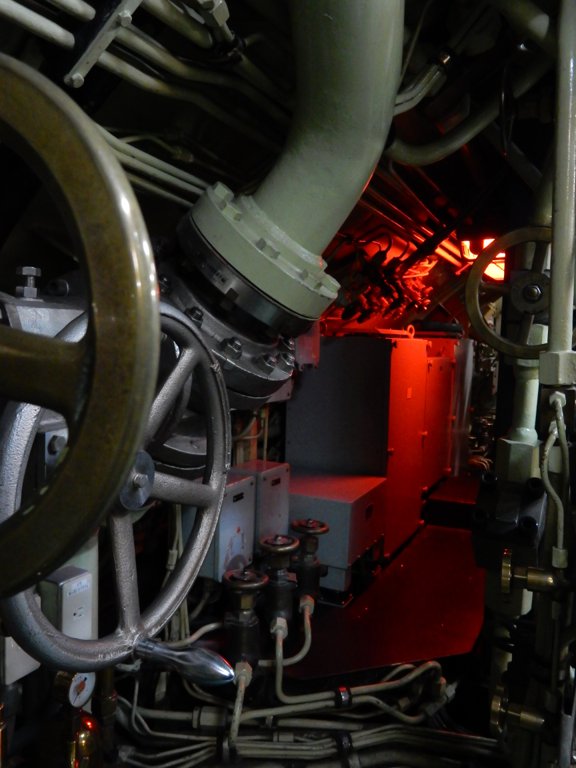
This screenshot has height=768, width=576. In order to click on screws in this screenshot , I will do `click(37, 270)`, `click(236, 349)`.